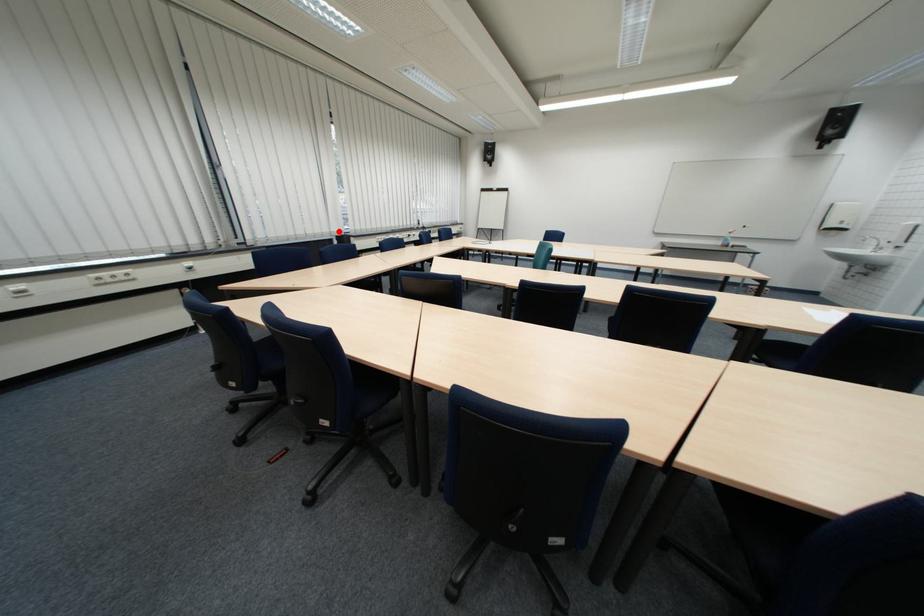
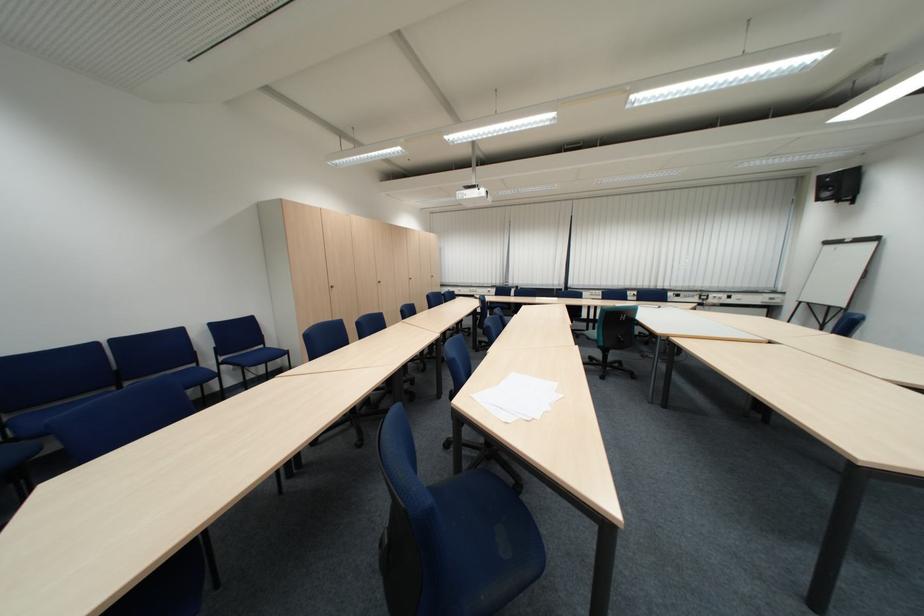
Find the pixel in the second image that matches the highlighted location in the first image.

(564, 284)